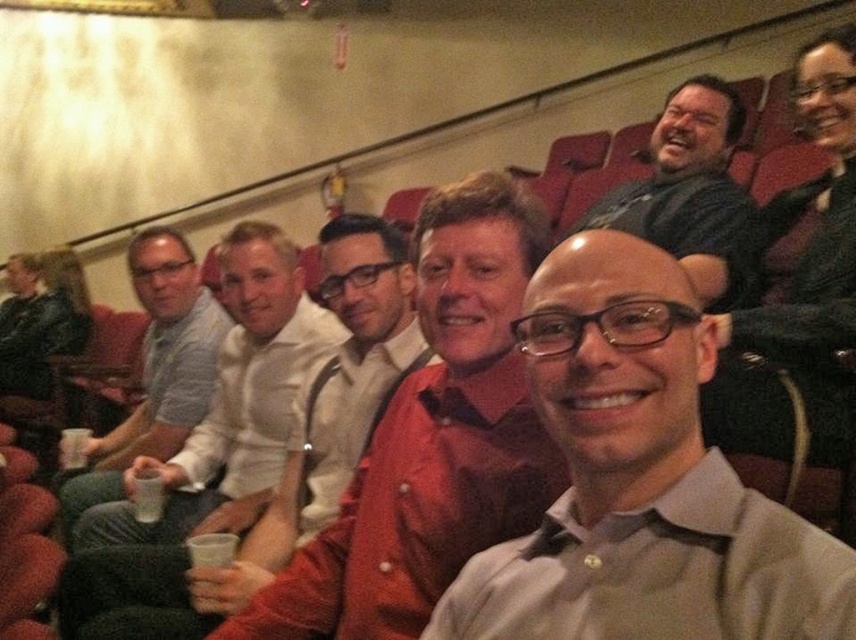
Question: Does matte black shirt at center have a lesser width compared to matte black shirt at upper center?

Choices:
 (A) no
 (B) yes

Answer: (B)

Question: Is white shirt at center below matte black shirt at upper center?

Choices:
 (A) no
 (B) yes

Answer: (B)

Question: Among these objects, which one is farthest from the camera?

Choices:
 (A) white paper cup at lower center
 (B) matte black shirt at center
 (C) matte black shirt at upper center

Answer: (C)

Question: Is white shirt at center further to camera compared to white matte cup at lower left?

Choices:
 (A) no
 (B) yes

Answer: (A)

Question: Among these objects, which one is nearest to the camera?

Choices:
 (A) gray matte shirt at center
 (B) white matte shirt at center

Answer: (A)

Question: Which object is the closest to the matte black shirt at upper center?

Choices:
 (A) white matte shirt at center
 (B) white matte cup at lower left
 (C) gray matte shirt at center

Answer: (C)